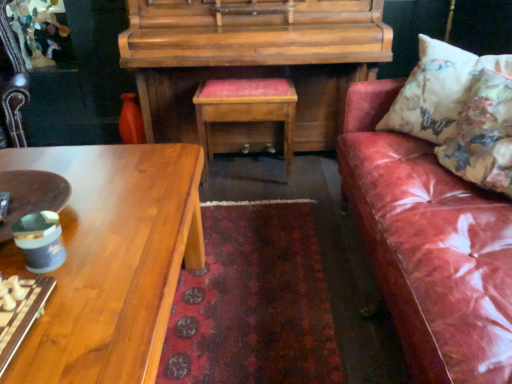
Question: Would you consider shiny wood coffee table at lower left to be distant from floral fabric cushion at right, which ranks as the 1th pillow in front-to-back order?

Choices:
 (A) yes
 (B) no

Answer: (A)

Question: From a real-world perspective, is shiny wood coffee table at lower left on top of floral fabric cushion at right, placed as the second pillow when sorted from back to front?

Choices:
 (A) no
 (B) yes

Answer: (A)

Question: Is shiny wood coffee table at lower left touching floral fabric cushion at right, placed as the second pillow when sorted from back to front?

Choices:
 (A) yes
 (B) no

Answer: (B)

Question: Is shiny wood coffee table at lower left at the right side of floral fabric cushion at right, which ranks as the 1th pillow in front-to-back order?

Choices:
 (A) yes
 (B) no

Answer: (B)

Question: From a real-world perspective, is shiny wood coffee table at lower left physically below floral fabric cushion at right, which ranks as the 1th pillow in front-to-back order?

Choices:
 (A) yes
 (B) no

Answer: (A)

Question: From the image's perspective, does shiny wood coffee table at lower left appear lower than floral fabric cushion at right, which ranks as the 1th pillow in front-to-back order?

Choices:
 (A) yes
 (B) no

Answer: (A)

Question: Is woodenwoodentable at center to the right of matte brown bowl at left from the viewer's perspective?

Choices:
 (A) yes
 (B) no

Answer: (A)

Question: From the image's perspective, does woodenwoodentable at center appear higher than matte brown bowl at left?

Choices:
 (A) yes
 (B) no

Answer: (A)

Question: Is woodenwoodentable at center looking in the opposite direction of matte brown bowl at left?

Choices:
 (A) no
 (B) yes

Answer: (B)

Question: Are woodenwoodentable at center and matte brown bowl at left far apart?

Choices:
 (A) no
 (B) yes

Answer: (B)

Question: Does woodenwoodentable at center appear on the left side of matte brown bowl at left?

Choices:
 (A) no
 (B) yes

Answer: (A)

Question: Considering the relative positions of woodenwoodentable at center and matte brown bowl at left in the image provided, is woodenwoodentable at center behind matte brown bowl at left?

Choices:
 (A) yes
 (B) no

Answer: (A)

Question: Does floral fabric cushion at right, placed as the second pillow when sorted from back to front, come behind floral fabric cushion at right, which is the first pillow in back-to-front order?

Choices:
 (A) no
 (B) yes

Answer: (A)